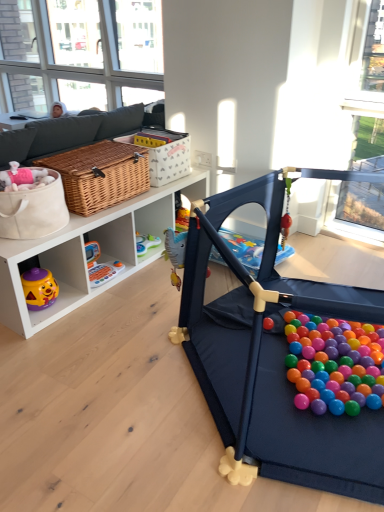
Question: Would you say woven brown picnic basket at center-left is inside or outside clear glass window at upper left?

Choices:
 (A) outside
 (B) inside

Answer: (A)

Question: From a real-world perspective, is woven brown picnic basket at center-left above or below clear glass window at upper left?

Choices:
 (A) above
 (B) below

Answer: (B)

Question: Which object is positioned farthest from the woven brown picnic basket at center-left?

Choices:
 (A) matte wicker basket at center-left, which is the 1th toy from right to left
 (B) rubberized plastic toy at lower left, placed as the second toy when sorted from front to back
 (C) woven brown basket at upper center
 (D) clear glass window at upper left

Answer: (D)

Question: Estimate the real-world distances between objects in this image. Which object is farther from the matte wicker basket at center-left, arranged as the 1th toy when viewed from the top?

Choices:
 (A) woven brown picnic basket at center-left
 (B) woven brown basket at upper center
 (C) rubberized plastic toy at lower left, placed as the second toy when sorted from front to back
 (D) clear glass window at upper left

Answer: (D)